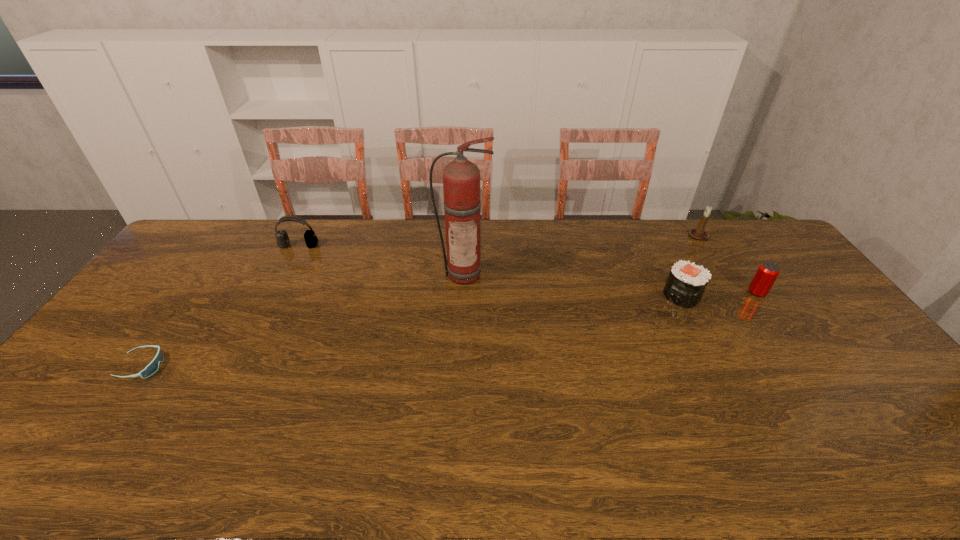
Where is `the tallest object`? The height and width of the screenshot is (540, 960). the tallest object is located at coordinates (461, 178).

Where is `the third object from left to right`? This screenshot has width=960, height=540. the third object from left to right is located at coordinates pos(461,178).

Where is `candle holder`? candle holder is located at coordinates (700, 234).

In order to click on headset in this screenshot , I will do `click(311, 240)`.

At what (x,y) coordinates should I click in order to perform the action: click on the rightmost object. Please return your answer as a coordinate pair (x, y). Looking at the image, I should click on (767, 273).

The width and height of the screenshot is (960, 540). Find the location of `the fourth object from left to right`. the fourth object from left to right is located at coordinates (686, 283).

Locate an element on the screen. The image size is (960, 540). goggles is located at coordinates (150, 369).

Locate an element on the screen. Image resolution: width=960 pixels, height=540 pixels. the nearest object is located at coordinates coord(150,369).

Where is `vacant region located on the side of the fire extinguisher with the label and nozzle`? vacant region located on the side of the fire extinguisher with the label and nozzle is located at coordinates (462, 336).

The image size is (960, 540). In order to click on vacant space located 0.170m on the side of the second object from right to left with the handle in this screenshot , I will do `click(723, 274)`.